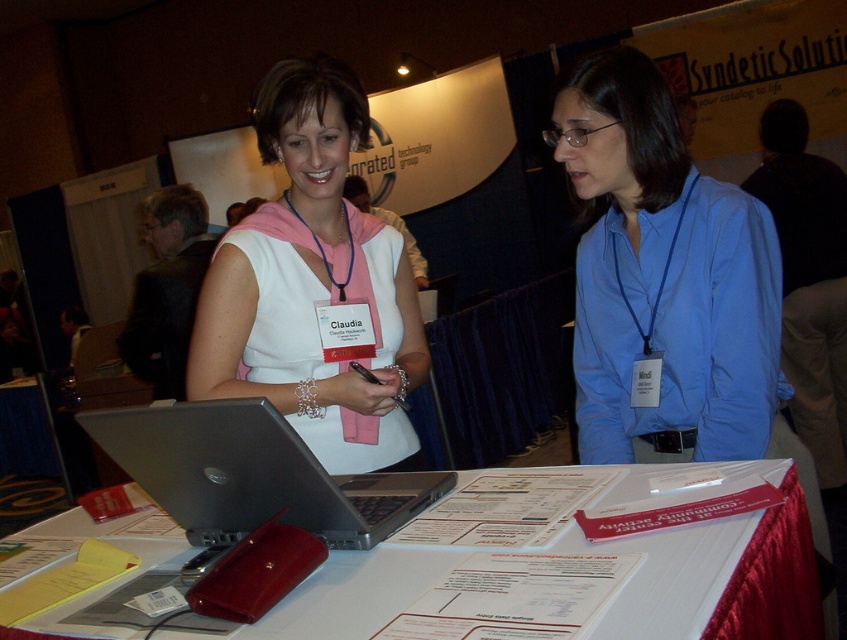
You are a photographer at the event and need to place a new camera on the table. The camera requires a space that is wider than the black suit jacket at left. Is there enough space on the table in front of the silver metallic laptop at center to accommodate it?

The silver metallic laptop at center might be wider than black suit jacket at left, so there may be sufficient space on the table in front of the silver metallic laptop at center to place the camera, but it depends on the exact dimensions of both items.

You are organizing a clothing display and need to place the white matte vest at center and the pink fabric scarf at upper center on a rack. Which item requires more horizontal space on the rack?

The white matte vest at center requires more horizontal space on the rack because its width is larger than the pink fabric scarf at upper center.

You are organizing a booth at a trade show and need to place both the white matte vest at center and the white paper at center on a shelf. If the shelf has limited space and you can only fit one of them, which item should you prioritize placing first based on their sizes?

The white matte vest at center is smaller than the white paper at center, so you should prioritize placing the white paper at center first since it takes up more space and needs to be accommodated before the smaller vest.